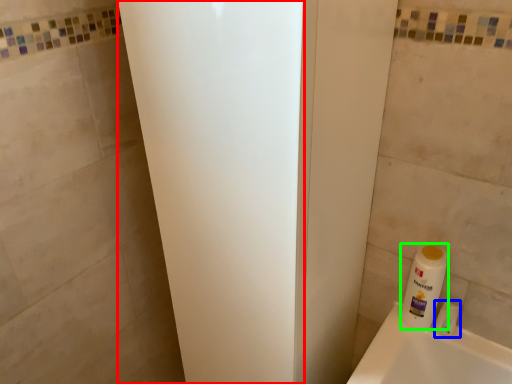
Question: Which object is the farthest from screen door (highlighted by a red box)? Choose among these: toiletry (highlighted by a blue box) or cleaning product (highlighted by a green box).

Choices:
 (A) toiletry
 (B) cleaning product

Answer: (A)